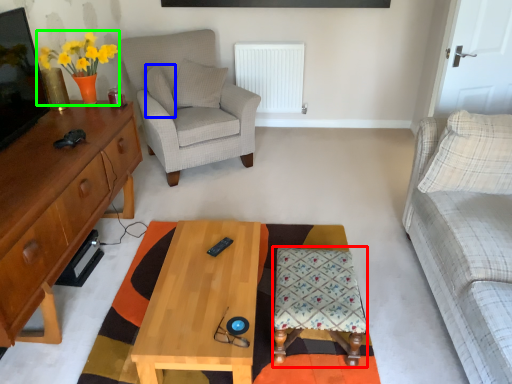
Question: Estimate the real-world distances between objects in this image. Which object is farther from stool (highlighted by a red box), pillow (highlighted by a blue box) or houseplant (highlighted by a green box)?

Choices:
 (A) pillow
 (B) houseplant

Answer: (A)